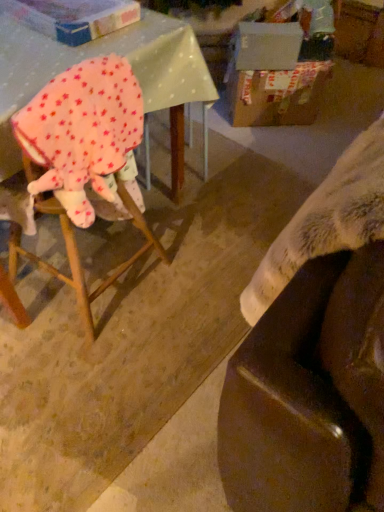
The image size is (384, 512). Describe the element at coordinates (74, 17) in the screenshot. I see `cardboard box at upper left, the second cardboard box positioned from the right` at that location.

Measure the distance between point (x=364, y=136) and camera.

The distance of point (x=364, y=136) from camera is 33.50 inches.

In order to face fluffy white blanket at lower right, should I rotate leftwards or rightwards?

It's best to rotate right around 23.280 degrees.

What is the approximate height of wooden chair at left?

wooden chair at left is 33.44 inches tall.

Image resolution: width=384 pixels, height=512 pixels. Identify the location of cardboard box at upper left, the second cardboard box when ordered from back to front. (74, 17).

Image resolution: width=384 pixels, height=512 pixels. Find the location of `cardboard box that is the 1st object located behind the fluffy white blanket at lower right`. cardboard box that is the 1st object located behind the fluffy white blanket at lower right is located at coordinates tap(74, 17).

Consider the image. Is cardboard box at upper left, the second cardboard box when ordered from back to front, not within fluffy white blanket at lower right?

Yes, cardboard box at upper left, the second cardboard box when ordered from back to front, is outside of fluffy white blanket at lower right.

Who is more distant, cardboard box at upper left, the second cardboard box positioned from the right, or fluffy white blanket at lower right?

cardboard box at upper left, the second cardboard box positioned from the right, is further away from the camera.

Would you say fluffy white blanket at lower right is to the left or to the right of cardboard box at upper left, the second cardboard box positioned from the right, in the picture?

Clearly, fluffy white blanket at lower right is on the right of cardboard box at upper left, the second cardboard box positioned from the right, in the image.

Does point (270, 292) appear closer or farther from the camera than point (101, 23)?

Point (270, 292).

Is fluffy white blanket at lower right bigger than cardboard box at upper left, the second cardboard box when ordered from back to front?

Indeed, fluffy white blanket at lower right has a larger size compared to cardboard box at upper left, the second cardboard box when ordered from back to front.

Who is shorter, fluffy white blanket at lower right or cardboard box at upper left, the second cardboard box positioned from the right?

cardboard box at upper left, the second cardboard box positioned from the right, is shorter.

Is point (82, 209) positioned behind point (323, 238)?

That is True.

Which of these two, pink fleece blanket at left or fluffy white blanket at lower right, stands shorter?

pink fleece blanket at left.

Would you consider pink fleece blanket at left to be distant from fluffy white blanket at lower right?

pink fleece blanket at left is actually quite close to fluffy white blanket at lower right.

Is pink fleece blanket at left oriented away from fluffy white blanket at lower right?

No, fluffy white blanket at lower right is not at the back of pink fleece blanket at left.

Considering the relative sizes of cardboard box at upper right, which is the 2th cardboard box in left-to-right order, and pink fleece blanket at left in the image provided, is cardboard box at upper right, which is the 2th cardboard box in left-to-right order, taller than pink fleece blanket at left?

Incorrect, the height of cardboard box at upper right, which is the 2th cardboard box in left-to-right order, is not larger of that of pink fleece blanket at left.

Considering the positions of objects cardboard box at upper right, which is the 2th cardboard box in left-to-right order, and pink fleece blanket at left in the image provided, who is more to the right, cardboard box at upper right, which is the 2th cardboard box in left-to-right order, or pink fleece blanket at left?

cardboard box at upper right, which is the 2th cardboard box in left-to-right order.

Between cardboard box at upper right, arranged as the second cardboard box when viewed from the front, and pink fleece blanket at left, which one is positioned in front?

pink fleece blanket at left.

Is cardboard box at upper right, which is the first cardboard box in back-to-front order, looking in the opposite direction of pink fleece blanket at left?

No.

Which is behind, wooden chair at left or fluffy white blanket at lower right?

wooden chair at left is behind.

From a real-world perspective, which is physically above, wooden chair at left or fluffy white blanket at lower right?

fluffy white blanket at lower right is physically above.

Is wooden chair at left at the left side of fluffy white blanket at lower right?

Correct, you'll find wooden chair at left to the left of fluffy white blanket at lower right.

Considering the relative sizes of wooden chair at left and fluffy white blanket at lower right in the image provided, is wooden chair at left shorter than fluffy white blanket at lower right?

No.

Could you tell me if cardboard box at upper left, the second cardboard box positioned from the right, is turned towards cardboard box at upper right, which is the first cardboard box in back-to-front order?

No.

Can you confirm if cardboard box at upper left, the second cardboard box when ordered from back to front, is thinner than cardboard box at upper right, which is the first cardboard box in back-to-front order?

Incorrect, the width of cardboard box at upper left, the second cardboard box when ordered from back to front, is not less than that of cardboard box at upper right, which is the first cardboard box in back-to-front order.

How much distance is there between cardboard box at upper left, which ranks as the first cardboard box in front-to-back order, and cardboard box at upper right, arranged as the second cardboard box when viewed from the front?

cardboard box at upper left, which ranks as the first cardboard box in front-to-back order, and cardboard box at upper right, arranged as the second cardboard box when viewed from the front, are 3.48 feet apart from each other.

Is point (45, 97) positioned in front of point (127, 168)?

That is True.

Considering the relative sizes of pink fleece blanket at left and wooden chair at left in the image provided, is pink fleece blanket at left smaller than wooden chair at left?

Indeed, pink fleece blanket at left has a smaller size compared to wooden chair at left.

Is pink fleece blanket at left in front of or behind wooden chair at left in the image?

pink fleece blanket at left is positioned closer to the viewer than wooden chair at left.

At what (x,y) coordinates should I click in order to perform the action: click on blanket located below the cardboard box at upper left, the second cardboard box when ordered from back to front (from the image's perspective). Please return your answer as a coordinate pair (x, y). Looking at the image, I should click on (326, 221).

Locate an element on the screen. The height and width of the screenshot is (512, 384). blanket below the cardboard box at upper left, which ranks as the first cardboard box in front-to-back order (from a real-world perspective) is located at coordinates (326, 221).

Based on their spatial positions, is wooden chair at left or pink fleece blanket at left closer to cardboard box at upper right, arranged as the second cardboard box when viewed from the front?

wooden chair at left lies closer to cardboard box at upper right, arranged as the second cardboard box when viewed from the front, than the other object.

Considering their positions, is cardboard box at upper left, the second cardboard box positioned from the right, positioned further to wooden chair at left than cardboard box at upper right, which is the first cardboard box from right to left?

The object further to wooden chair at left is cardboard box at upper right, which is the first cardboard box from right to left.

Looking at the image, which one is located closer to cardboard box at upper left, the first cardboard box viewed from the left, fluffy white blanket at lower right or pink fleece blanket at left?

pink fleece blanket at left is positioned closer to the anchor cardboard box at upper left, the first cardboard box viewed from the left.

Looking at this image, looking at the image, which one is located further to wooden chair at left, cardboard box at upper right, which is the first cardboard box from right to left, or pink fleece blanket at left?

The object further to wooden chair at left is cardboard box at upper right, which is the first cardboard box from right to left.

From the image, which object appears to be nearer to cardboard box at upper left, the second cardboard box positioned from the right, pink fleece blanket at left or wooden chair at left?

pink fleece blanket at left is closer to cardboard box at upper left, the second cardboard box positioned from the right.

From the image, which object appears to be farther from pink fleece blanket at left, wooden chair at left or fluffy white blanket at lower right?

fluffy white blanket at lower right is positioned further to the anchor pink fleece blanket at left.

Estimate the real-world distances between objects in this image. Which object is further from fluffy white blanket at lower right, cardboard box at upper right, which is the first cardboard box in back-to-front order, or cardboard box at upper left, the second cardboard box positioned from the right?

cardboard box at upper right, which is the first cardboard box in back-to-front order, is positioned further to the anchor fluffy white blanket at lower right.

Based on their spatial positions, is cardboard box at upper right, which is the first cardboard box from right to left, or fluffy white blanket at lower right further from pink fleece blanket at left?

Among the two, cardboard box at upper right, which is the first cardboard box from right to left, is located further to pink fleece blanket at left.

This screenshot has width=384, height=512. I want to click on chair located between fluffy white blanket at lower right and cardboard box at upper right, which is the 2th cardboard box in left-to-right order, in the depth direction, so click(84, 159).

I want to click on cardboard box between fluffy white blanket at lower right and cardboard box at upper right, which is the first cardboard box from right to left, in the front-back direction, so click(x=74, y=17).

Find the location of a particular element. This screenshot has width=384, height=512. chair situated between cardboard box at upper left, the first cardboard box viewed from the left, and fluffy white blanket at lower right from left to right is located at coordinates (84, 159).

This screenshot has height=512, width=384. I want to click on woman between fluffy white blanket at lower right and cardboard box at upper right, which is the 2th cardboard box in left-to-right order, along the z-axis, so click(85, 135).